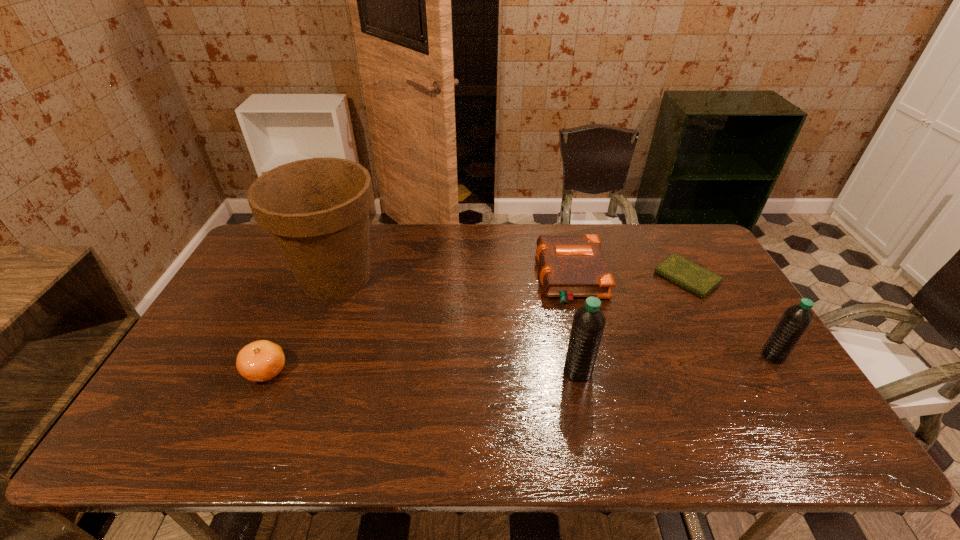
Locate an element on the screen. object located in the left edge section of the desktop is located at coordinates (317, 210).

The image size is (960, 540). I want to click on water bottle that is at the right edge, so click(796, 319).

Identify the location of diary that is at the right edge. (694, 278).

In order to click on object present at the far left corner in this screenshot , I will do `click(317, 210)`.

Where is `object that is positioned at the far right corner`? This screenshot has height=540, width=960. object that is positioned at the far right corner is located at coordinates (694, 278).

Find the location of a particular element. This screenshot has width=960, height=540. vacant area at the far edge of the desktop is located at coordinates (550, 229).

Find the location of a particular element. free space at the near edge of the desktop is located at coordinates (372, 396).

Where is `vacant position at the right edge of the desktop`? The image size is (960, 540). vacant position at the right edge of the desktop is located at coordinates (737, 310).

Find the location of a particular element. The width and height of the screenshot is (960, 540). vacant space at the far right corner of the desktop is located at coordinates (674, 235).

Find the location of `vacant area between the tallest object and the Bible`. vacant area between the tallest object and the Bible is located at coordinates (453, 277).